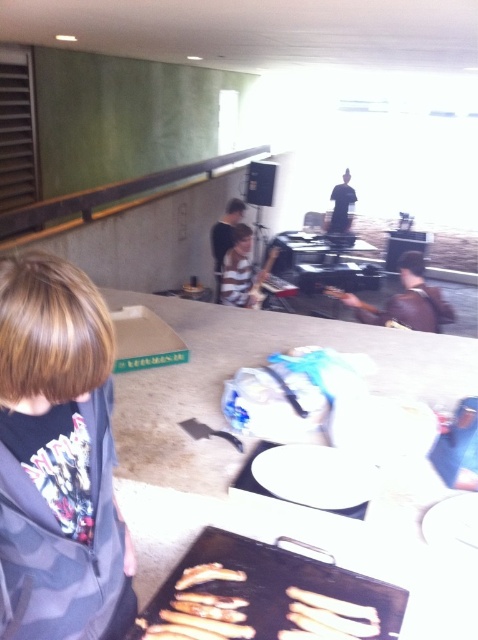
You are a food delivery person who needs to place a small container on the counter. The container is 2 inches wide. Is there enough space between the golden crispy fries at lower center and the dark brown leather jacket at center to fit it?

The golden crispy fries at lower center is thinner than the dark brown leather jacket at center. Since the container is only 2 inches wide, there should be enough space between them to fit it as the fries are thinner, allowing space for the container.

You are a fashion designer observing the scene. You see the dark brown leather jacket at center and the dark blue shirt at center. Which clothing item is shorter in height?

The dark brown leather jacket at center is not as tall as the dark blue shirt at center, so the dark brown leather jacket at center is shorter in height.

You are a person standing in the cafeteria and you want to grab the golden crispy breadstick at center without touching the dark brown leather jacket at center. Is this possible?

The dark brown leather jacket at center is much taller than the golden crispy breadstick at center, so you can reach around or move the jacket to access the breadstick without touching it.